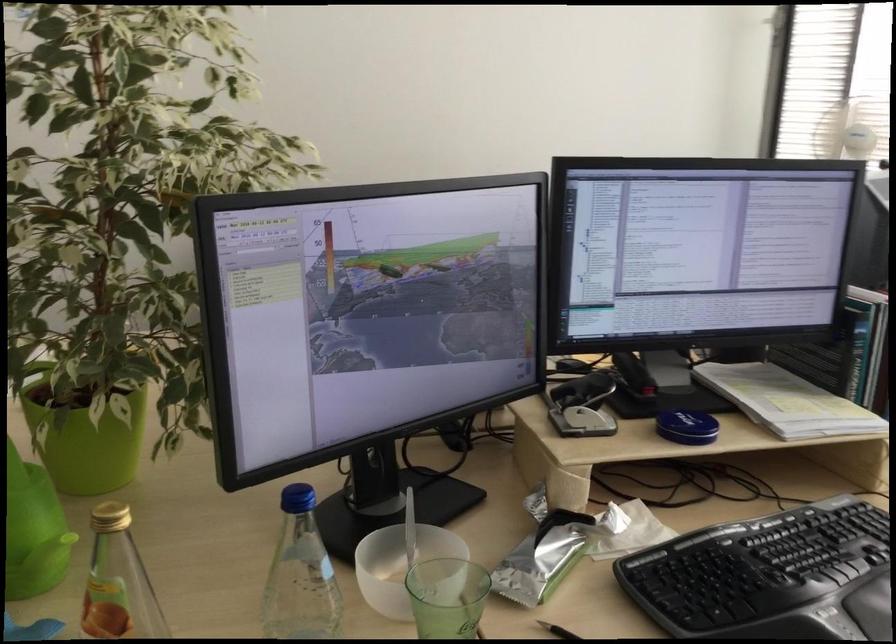
What do you see at coordinates (409, 529) in the screenshot? The image size is (896, 644). I see `a spoon handle` at bounding box center [409, 529].